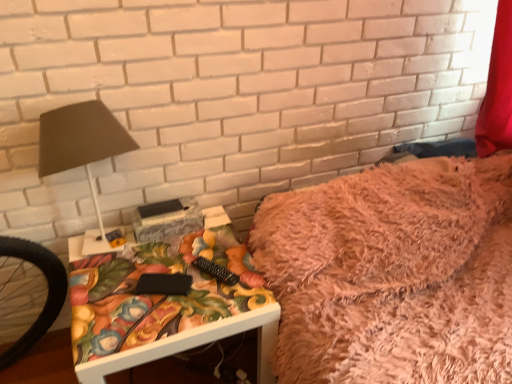
Where is `empty space that is ontop of white glossy table at lower left (from a real-world perspective)`? This screenshot has width=512, height=384. empty space that is ontop of white glossy table at lower left (from a real-world perspective) is located at coordinates (161, 279).